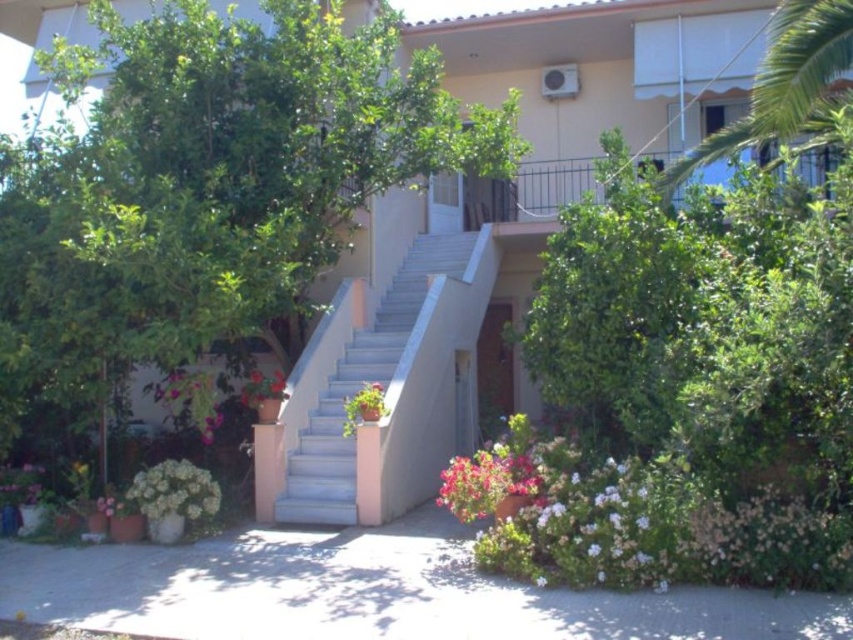
Question: Among these points, which one is nearest to the camera?

Choices:
 (A) (308, 490)
 (B) (782, 17)
 (C) (213, 481)
 (D) (225, 42)

Answer: (C)

Question: In this image, where is vivid pink petals at lower center located relative to white matte flowers at lower left?

Choices:
 (A) above
 (B) below

Answer: (A)

Question: Is green leafy tree at center wider than green leafy tree at upper right?

Choices:
 (A) no
 (B) yes

Answer: (B)

Question: Is green leafy tree at upper right thinner than vivid pink petals at lower center?

Choices:
 (A) no
 (B) yes

Answer: (A)

Question: Which of these objects is positioned farthest from the green leafy tree at center?

Choices:
 (A) white matte flowers at lower left
 (B) white concrete stairs at center

Answer: (B)

Question: Among these points, which one is farthest from the camera?

Choices:
 (A) tap(164, 506)
 (B) tap(320, 426)

Answer: (B)